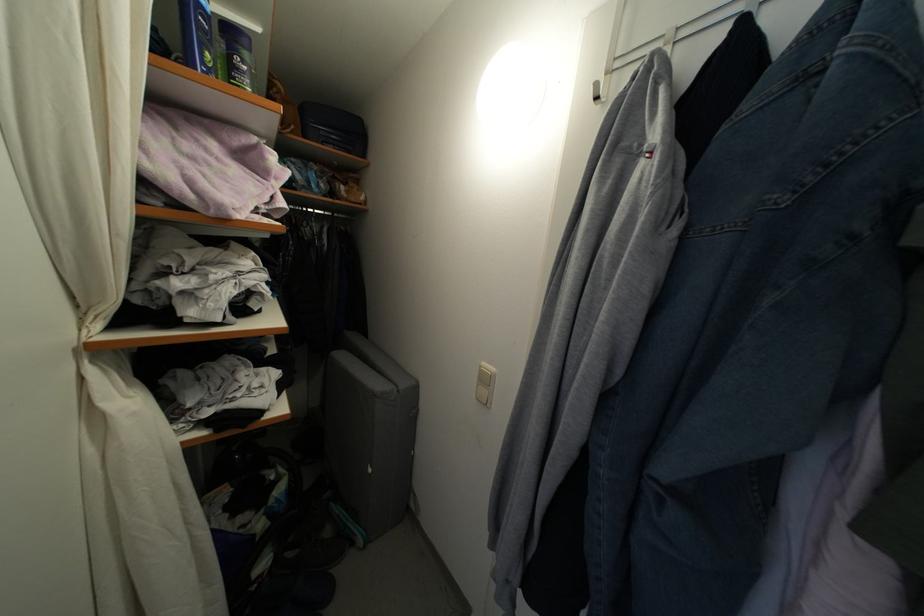
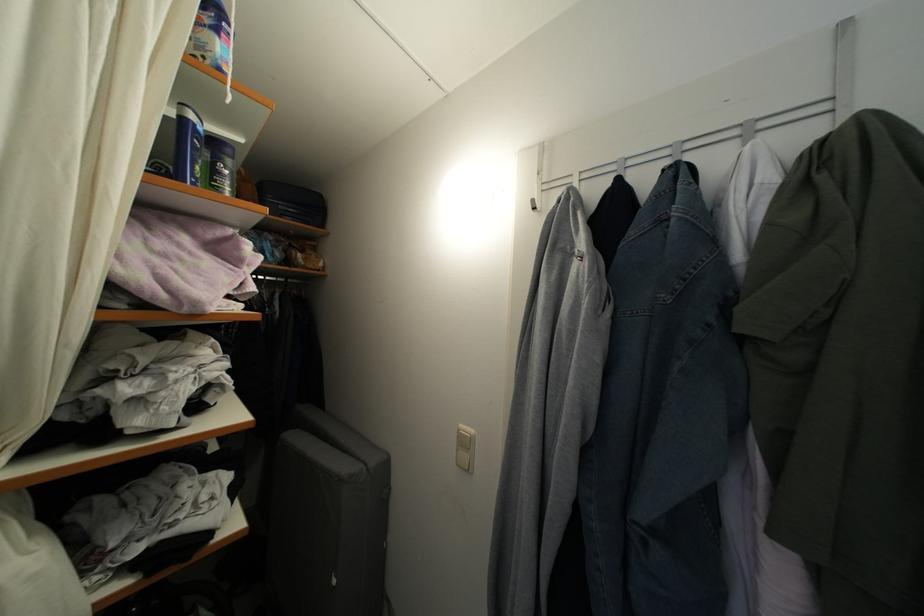
The point at (327, 139) is marked in the first image. Where is the corresponding point in the second image?

(286, 214)